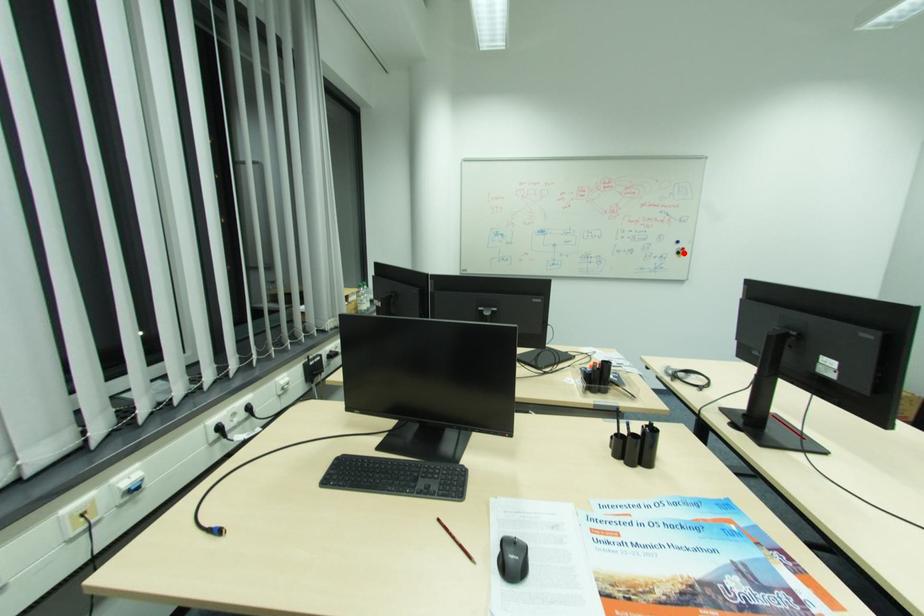
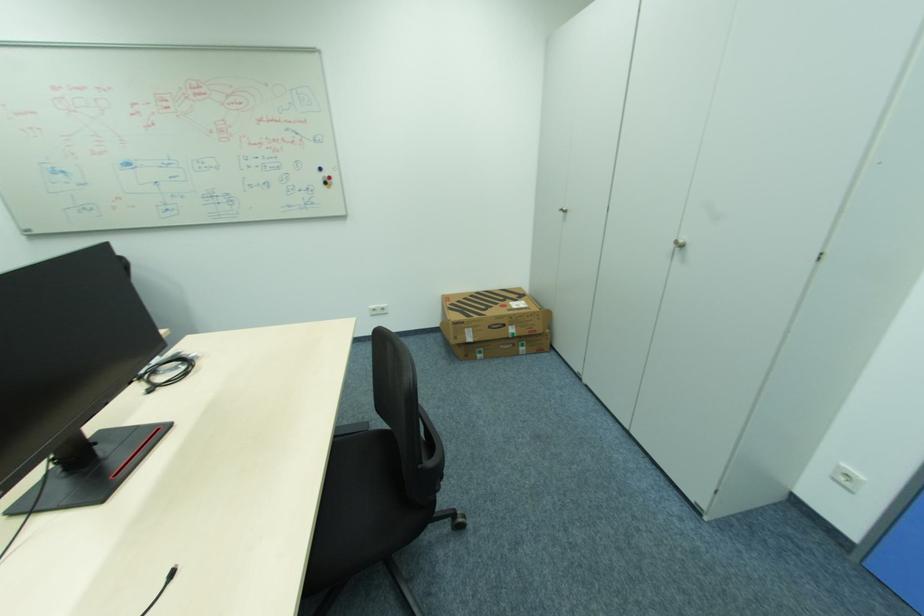
Question: I am providing you with two images of the same scene from different viewpoints. Given a red point in image1, look at the same physical point in image2. Is it:

Choices:
 (A) Closer to the viewpoint
 (B) Farther from the viewpoint

Answer: (A)